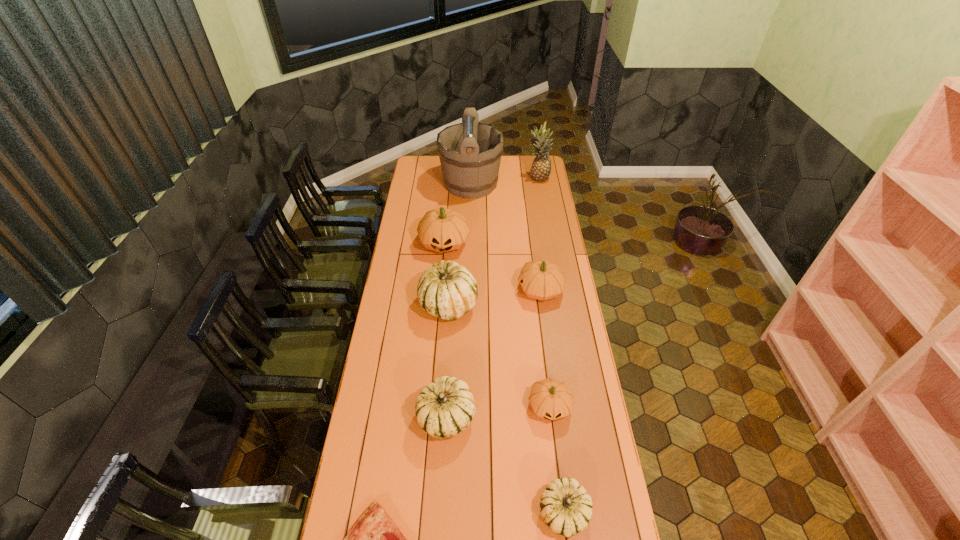
Identify the location of bucket. (470, 152).

Locate an element on the screen. Image resolution: width=960 pixels, height=540 pixels. green pineapple is located at coordinates (541, 166).

Where is `the farthest orange gourd`? the farthest orange gourd is located at coordinates (443, 229).

Identify the location of the leftmost orange gourd. (443, 229).

You are a GUI agent. You are given a task and a screenshot of the screen. Output one action in this format:
    pyautogui.click(x=<x>, y=<y>)
    Task: Click on the biggest white gourd
    
    Given the screenshot: What is the action you would take?
    coord(447,290)

In order to click on the second smallest orange gourd in this screenshot , I will do (540, 279).

The height and width of the screenshot is (540, 960). Identify the location of the second biggest white gourd. (444, 408).

Find the location of a particular element. The image size is (960, 540). the smallest orange gourd is located at coordinates (x=550, y=399).

Find the location of a particular element. Image resolution: width=960 pixels, height=540 pixels. free spot located on the back of the bucket is located at coordinates (471, 158).

Locate an element on the screen. The height and width of the screenshot is (540, 960). vacant space located on the front of the pineapple is located at coordinates (541, 193).